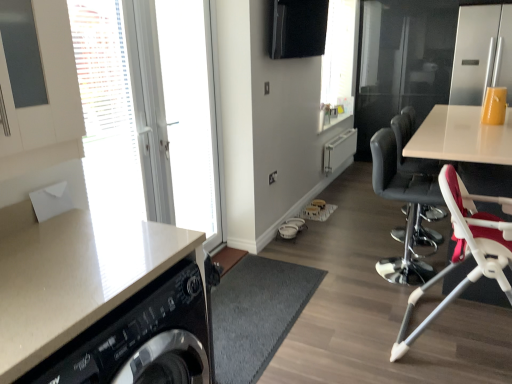
Measure the distance between point (367, 142) and camera.

They are 5.67 meters apart.

Describe the element at coordinates (402, 62) in the screenshot. This screenshot has width=512, height=384. I see `transparent glass screen door at upper right` at that location.

Locate an element on the screen. Image resolution: width=512 pixels, height=384 pixels. transparent glass window screen at upper center, which is the second window screen in front-to-back order is located at coordinates (338, 63).

This screenshot has height=384, width=512. Find the location of `white plastic high chair at right`. white plastic high chair at right is located at coordinates (461, 137).

Find the location of a particular element. This screenshot has width=512, height=384. transparent glass screen door at upper right is located at coordinates (402, 62).

The width and height of the screenshot is (512, 384). What are the coordinates of `countertop above the black glossy washing machine at lower left (from a real-world perspective)` in the screenshot? It's located at (103, 303).

Is white glossy countertop at lower left located within black glossy washing machine at lower left?

No, white glossy countertop at lower left is not a part of black glossy washing machine at lower left.

Which object is closer to the camera, black glossy washing machine at lower left or white glossy countertop at lower left?

white glossy countertop at lower left.

Consider the image. Between black glossy washing machine at lower left and white glossy countertop at lower left, which one has less height?

With less height is black glossy washing machine at lower left.

Between point (406, 176) and point (490, 152), which one is positioned behind?

The point (406, 176) is farther from the camera.

From the image's perspective, which object appears higher, black leather chair at right, which appears as the 1th chair when viewed from the back, or white plastic high chair at right?

white plastic high chair at right appears higher in the image.

How different are the orientations of red fabric high chair at right, positioned as the second chair in back-to-front order, and black glossy washing machine at lower left in degrees?

0.105 degrees.

You are a GUI agent. You are given a task and a screenshot of the screen. Output one action in this format:
    pyautogui.click(x=<x>, y=<y>)
    Task: Click on the 2nd chair to the right of the black glossy washing machine at lower left, starting your count from the anchor
    This screenshot has height=384, width=512.
    Given the screenshot: What is the action you would take?
    pyautogui.click(x=465, y=250)

Is red fabric high chair at right, arranged as the first chair when viewed from the front, oriented away from black glossy washing machine at lower left?

Absolutely, red fabric high chair at right, arranged as the first chair when viewed from the front, is directed away from black glossy washing machine at lower left.

From the image's perspective, who appears lower, red fabric high chair at right, arranged as the first chair when viewed from the front, or black glossy washing machine at lower left?

black glossy washing machine at lower left is shown below in the image.

From the image's perspective, is black leather chair at right, which appears as the 2th chair when viewed from the front, on top of white glossy countertop at lower left?

Correct, black leather chair at right, which appears as the 2th chair when viewed from the front, appears higher than white glossy countertop at lower left in the image.

In the scene shown: Would you say black leather chair at right, which appears as the 2th chair when viewed from the front, is inside or outside white glossy countertop at lower left?

black leather chair at right, which appears as the 2th chair when viewed from the front, lies outside white glossy countertop at lower left.

Is white glossy countertop at lower left at the back of black leather chair at right, which appears as the 2th chair when viewed from the front?

black leather chair at right, which appears as the 2th chair when viewed from the front, is not turned away from white glossy countertop at lower left.

From a real-world perspective, is black leather chair at right, which appears as the 1th chair when viewed from the back, above or below white glossy countertop at lower left?

Clearly, from a real-world perspective, black leather chair at right, which appears as the 1th chair when viewed from the back, is below white glossy countertop at lower left.

Is white glossy countertop at lower left at the back of transparent glass screen door at upper right?

No, transparent glass screen door at upper right is not facing away from white glossy countertop at lower left.

What's the angular difference between transparent glass screen door at upper right and white glossy countertop at lower left's facing directions?

90.1 degrees separate the facing orientations of transparent glass screen door at upper right and white glossy countertop at lower left.

Is transparent glass screen door at upper right closer to the viewer compared to white glossy countertop at lower left?

No, it is behind white glossy countertop at lower left.

Does transparent glass screen door at upper right have a greater height compared to white glossy countertop at lower left?

Yes, transparent glass screen door at upper right is taller than white glossy countertop at lower left.

Are white glossy door at left, the first window when ordered from front to back, and white glossy countertop at lower left far apart?

They are positioned close to each other.

Is white glossy door at left, the first window when ordered from front to back, taller or shorter than white glossy countertop at lower left?

white glossy door at left, the first window when ordered from front to back, is taller than white glossy countertop at lower left.

Considering the sizes of objects white glossy door at left, which ranks as the second window in back-to-front order, and white glossy countertop at lower left in the image provided, who is smaller, white glossy door at left, which ranks as the second window in back-to-front order, or white glossy countertop at lower left?

white glossy door at left, which ranks as the second window in back-to-front order, is smaller.

From their relative heights in the image, would you say black leather chair at right, which appears as the 1th chair when viewed from the back, is taller or shorter than black leather bar stool at right?

In the image, black leather chair at right, which appears as the 1th chair when viewed from the back, appears to be shorter than black leather bar stool at right.

Can you confirm if black leather chair at right, which appears as the 1th chair when viewed from the back, is wider than black leather bar stool at right?

Yes.

Is black leather chair at right, which appears as the 1th chair when viewed from the back, oriented towards black leather bar stool at right?

No, black leather chair at right, which appears as the 1th chair when viewed from the back, is not oriented towards black leather bar stool at right.

Image resolution: width=512 pixels, height=384 pixels. Find the location of `flat on the right of white glossy countertop at lower left`. flat on the right of white glossy countertop at lower left is located at coordinates (256, 314).

This screenshot has height=384, width=512. In order to click on computer desk above the black leather chair at right, which appears as the 2th chair when viewed from the front (from the image's perspective) in this screenshot , I will do `click(461, 137)`.

From the image, which object appears to be farther from white glossy door at left, the first window when ordered from front to back, white glossy door at left, which is counted as the first window, starting from the back, or black glossy washing machine at lower left?

Among the two, black glossy washing machine at lower left is located further to white glossy door at left, the first window when ordered from front to back.

Looking at this image, based on their spatial positions, is white glass door at left, arranged as the first window screen when viewed from the front, or transparent glass window screen at upper center, the 1th window screen when ordered from right to left, closer to black glossy washing machine at lower left?

white glass door at left, arranged as the first window screen when viewed from the front.

Considering their positions, is black glossy washing machine at lower left positioned further to black leather chair at right, which appears as the 2th chair when viewed from the front, than white glossy door at left, the 2th window from the front?

white glossy door at left, the 2th window from the front, is positioned further to the anchor black leather chair at right, which appears as the 2th chair when viewed from the front.

Based on their spatial positions, is white glossy door at left, which ranks as the second window in back-to-front order, or black leather bar stool at right further from black glossy washing machine at lower left?

black leather bar stool at right lies further to black glossy washing machine at lower left than the other object.

Which object lies further to the anchor point transparent glass screen door at upper right, black glossy washing machine at lower left or black leather chair at right, which appears as the 1th chair when viewed from the back?

black glossy washing machine at lower left.

Considering their positions, is transparent glass screen door at upper right positioned further to black leather chair at right, which appears as the 1th chair when viewed from the back, than white plastic high chair at right?

transparent glass screen door at upper right lies further to black leather chair at right, which appears as the 1th chair when viewed from the back, than the other object.

From the image, which object appears to be nearer to red fabric high chair at right, positioned as the second chair in back-to-front order, white glossy countertop at lower left or transparent glass screen door at upper right?

white glossy countertop at lower left lies closer to red fabric high chair at right, positioned as the second chair in back-to-front order, than the other object.

Based on their spatial positions, is red fabric high chair at right, positioned as the second chair in back-to-front order, or white glass door at left, which is counted as the second window screen, starting from the right, further from white plastic high chair at right?

The object further to white plastic high chair at right is white glass door at left, which is counted as the second window screen, starting from the right.

This screenshot has width=512, height=384. Find the location of `flat situated between white glossy door at left, which is counted as the first window, starting from the back, and red fabric high chair at right, positioned as the second chair in back-to-front order, from left to right`. flat situated between white glossy door at left, which is counted as the first window, starting from the back, and red fabric high chair at right, positioned as the second chair in back-to-front order, from left to right is located at coordinates [x=256, y=314].

At what (x,y) coordinates should I click in order to perform the action: click on window positioned between white glossy door at left, which ranks as the second window in back-to-front order, and white glass door at left, which is counted as the second window screen, starting from the right, from near to far. Please return your answer as a coordinate pair (x, y). Looking at the image, I should click on pos(151,109).

Where is `flat between white glossy countertop at lower left and transparent glass window screen at upper center, which is the second window screen in front-to-back order, in the front-back direction`? flat between white glossy countertop at lower left and transparent glass window screen at upper center, which is the second window screen in front-to-back order, in the front-back direction is located at coordinates (256, 314).

Identify the location of flat positioned between white glossy door at left, which ranks as the second window in back-to-front order, and transparent glass screen door at upper right from near to far. This screenshot has width=512, height=384. (256, 314).